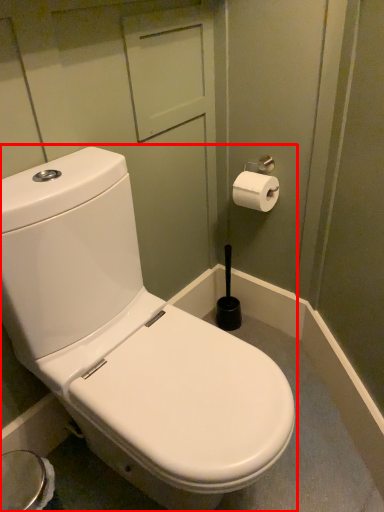
Question: Where is toilet (annotated by the red box) located in relation to toilet paper in the image?

Choices:
 (A) left
 (B) right

Answer: (A)